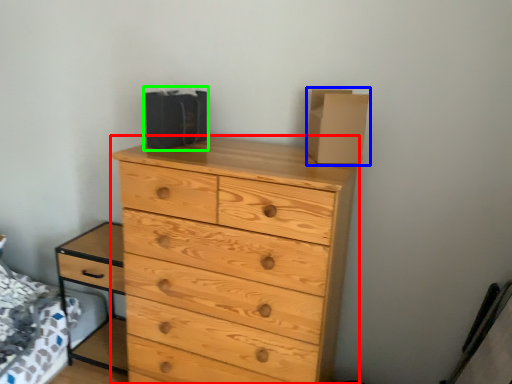
Question: Estimate the real-world distances between objects in this image. Which object is closer to chest of drawers (highlighted by a red box), cardboard box (highlighted by a blue box) or cardboard box (highlighted by a green box)?

Choices:
 (A) cardboard box
 (B) cardboard box

Answer: (A)